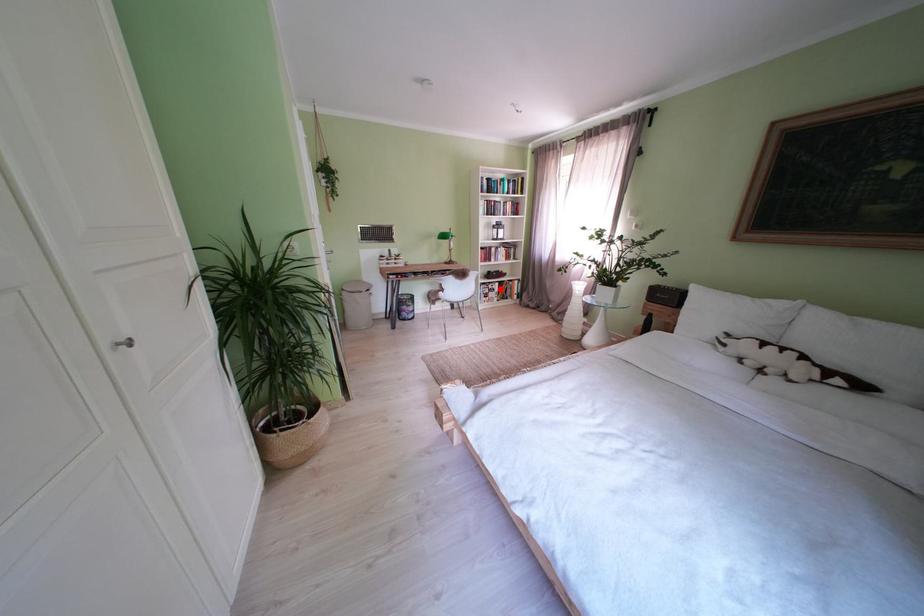
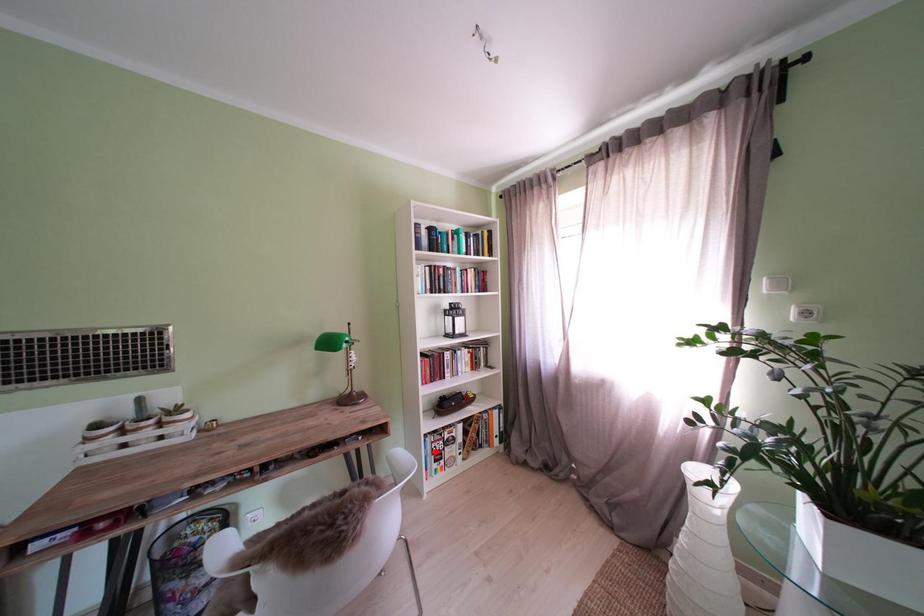
Consider the image. I am providing you with two images of the same scene from different viewpoints. A red point is marked on the first image and another point is marked on the second image. Is the red point in image1 aligned with the point shown in image2?

No